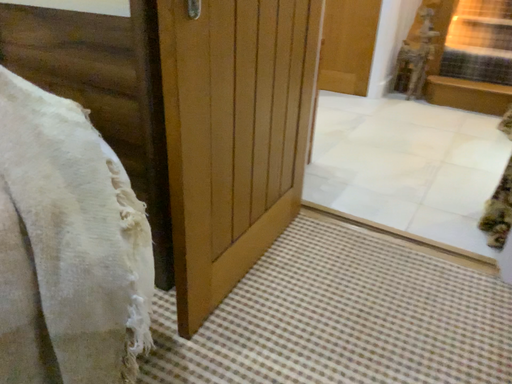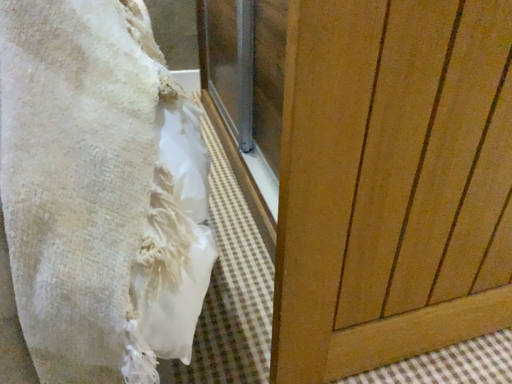
Question: Which way did the camera rotate in the video?

Choices:
 (A) rotated right
 (B) rotated left

Answer: (B)